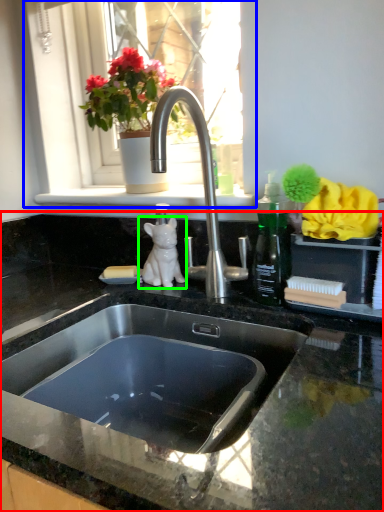
Question: Which object is positioned farthest from countertop (highlighted by a red box)? Select from window (highlighted by a blue box) and animal (highlighted by a green box).

Choices:
 (A) window
 (B) animal

Answer: (A)